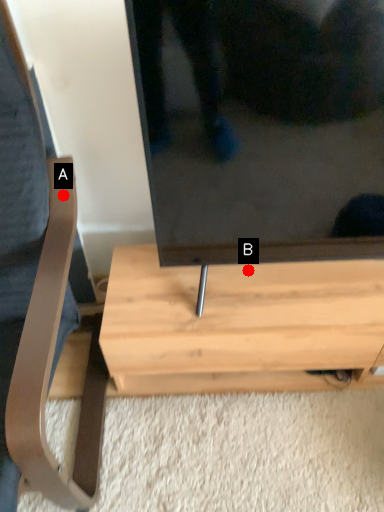
Question: Two points are circled on the image, labeled by A and B beside each circle. Which point is farther to the camera?

Choices:
 (A) A is further
 (B) B is further

Answer: (B)